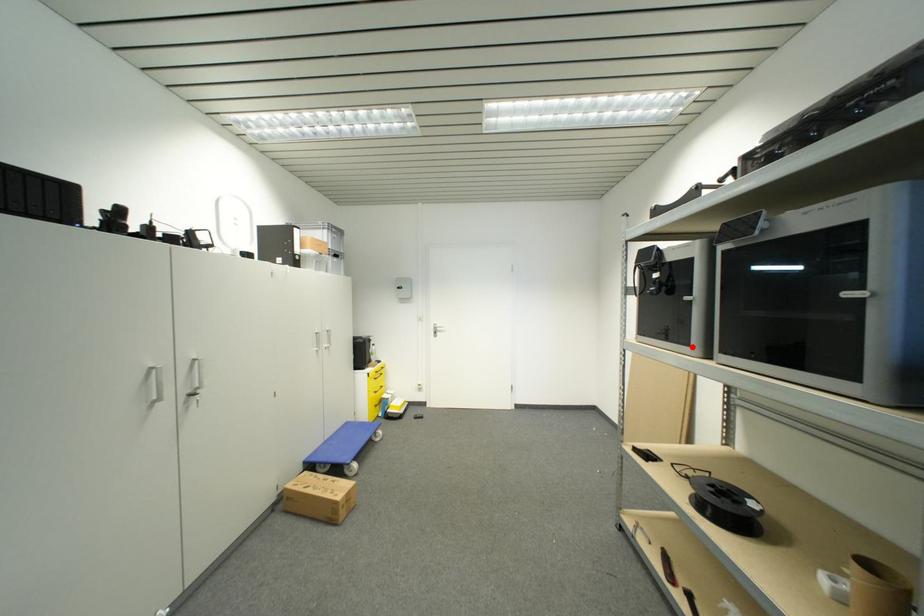
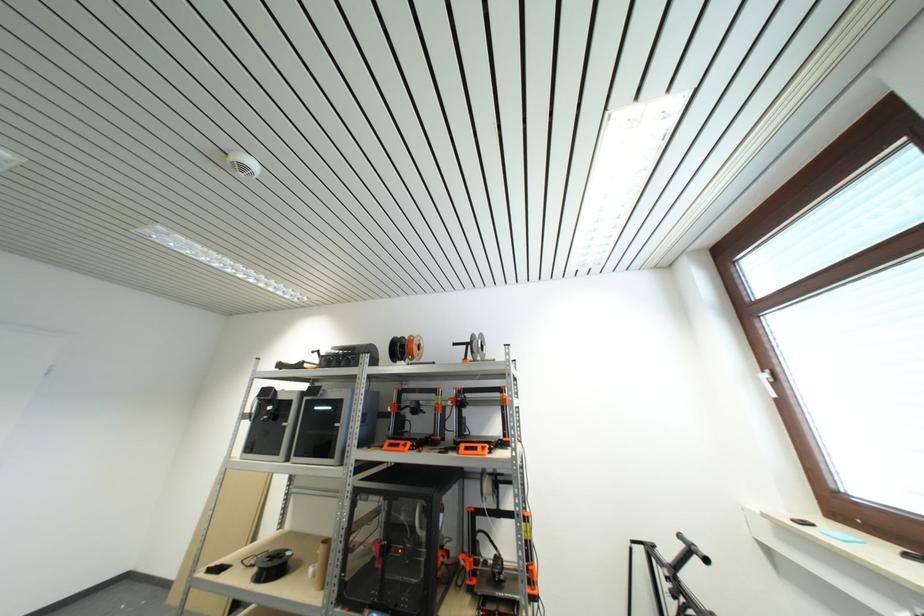
Locate, in the second image, the point that corresponds to the highlighted location in the first image.

(283, 456)